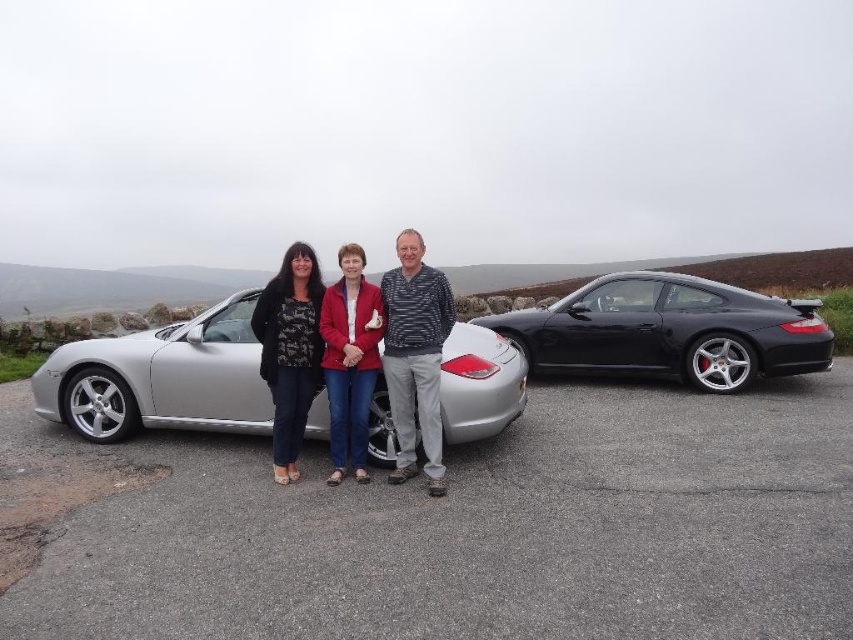
Between black metallic car at right and matte black top at center, which one appears on the right side from the viewer's perspective?

black metallic car at right is more to the right.

From the picture: Who is more distant from viewer, (471, 317) or (281, 445)?

Positioned behind is point (471, 317).

Locate an element on the screen. The width and height of the screenshot is (853, 640). black metallic car at right is located at coordinates (670, 330).

Which of these two, matte black top at center or matte red jacket at center, stands shorter?

matte red jacket at center

Measure the distance from matte black top at center to matte red jacket at center.

matte black top at center is 12.23 inches from matte red jacket at center.

Does point (305, 273) lie behind point (372, 348)?

That is True.

The width and height of the screenshot is (853, 640). I want to click on matte black top at center, so click(x=289, y=349).

Does point (374, 330) come closer to viewer compared to point (373, 355)?

Yes, point (374, 330) is closer to viewer.

Which is in front, point (325, 312) or point (370, 339)?

Point (370, 339) is more forward.

The image size is (853, 640). What are the coordinates of `matte black car at center` in the screenshot? It's located at click(x=318, y=355).